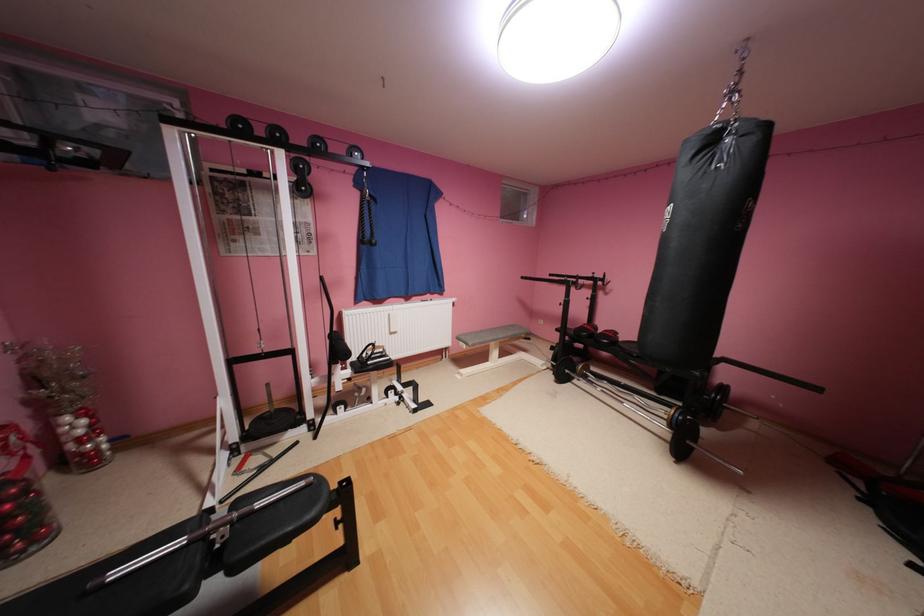
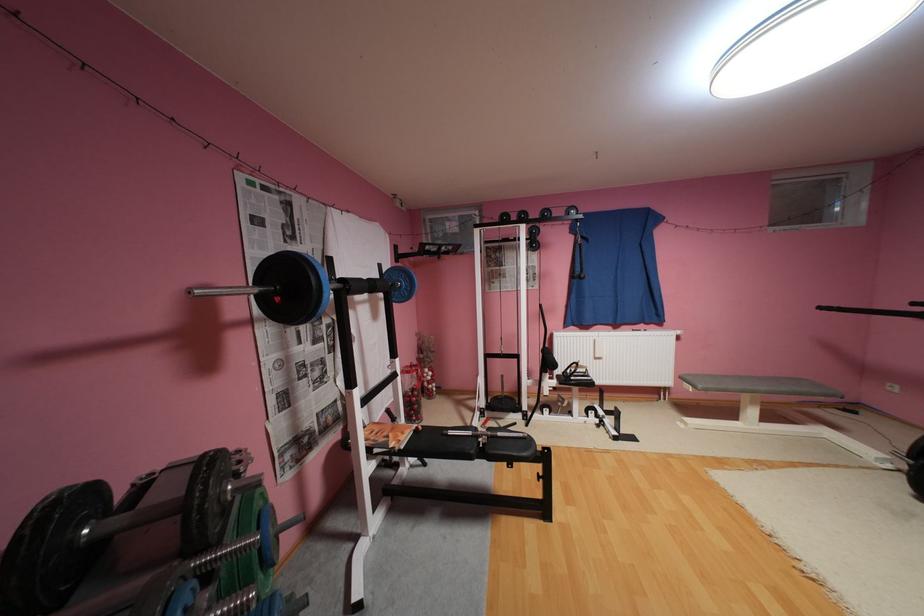
Locate, in the second image, the point that corresponds to (508,336) in the first image.

(771, 387)